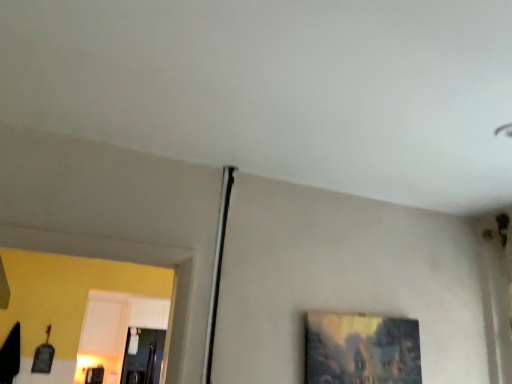
The image size is (512, 384). What do you see at coordinates (361, 349) in the screenshot?
I see `matte wooden picture frame at lower right` at bounding box center [361, 349].

Image resolution: width=512 pixels, height=384 pixels. I want to click on matte wooden picture frame at lower right, so click(361, 349).

The image size is (512, 384). What do you see at coordinates (143, 356) in the screenshot? I see `transparent glass door at lower left` at bounding box center [143, 356].

The image size is (512, 384). I want to click on transparent glass door at lower left, so click(143, 356).

This screenshot has width=512, height=384. What are the coordinates of `matte wooden picture frame at lower right` in the screenshot? It's located at (361, 349).

Considering the relative positions of transparent glass door at lower left and matte wooden picture frame at lower right in the image provided, is transparent glass door at lower left to the left or to the right of matte wooden picture frame at lower right?

transparent glass door at lower left is to the left of matte wooden picture frame at lower right.

Which object is further away from the camera taking this photo, transparent glass door at lower left or matte wooden picture frame at lower right?

transparent glass door at lower left is more distant.

Considering the positions of points (138, 350) and (333, 331), is point (138, 350) closer to camera compared to point (333, 331)?

No.

Based on the photo, from the image's perspective, which is below, transparent glass door at lower left or matte wooden picture frame at lower right?

transparent glass door at lower left is shown below in the image.

From a real-world perspective, is transparent glass door at lower left above or below matte wooden picture frame at lower right?

In terms of real-world spatial position, transparent glass door at lower left is below matte wooden picture frame at lower right.

Looking at their sizes, would you say transparent glass door at lower left is wider or thinner than matte wooden picture frame at lower right?

In the image, transparent glass door at lower left appears to be wider than matte wooden picture frame at lower right.

Which of these two, transparent glass door at lower left or matte wooden picture frame at lower right, stands shorter?

matte wooden picture frame at lower right is shorter.

Who is bigger, transparent glass door at lower left or matte wooden picture frame at lower right?

Bigger between the two is transparent glass door at lower left.

Is transparent glass door at lower left inside or outside of matte wooden picture frame at lower right?

transparent glass door at lower left is not inside matte wooden picture frame at lower right, it's outside.

Is transparent glass door at lower left touching matte wooden picture frame at lower right?

transparent glass door at lower left and matte wooden picture frame at lower right are clearly separated.

Is transparent glass door at lower left oriented towards matte wooden picture frame at lower right?

Yes, transparent glass door at lower left is aimed at matte wooden picture frame at lower right.

Image resolution: width=512 pixels, height=384 pixels. I want to click on picture frame in front of the transparent glass door at lower left, so coord(361,349).

In the scene shown: Considering the relative positions of matte wooden picture frame at lower right and transparent glass door at lower left in the image provided, is matte wooden picture frame at lower right to the left of transparent glass door at lower left from the viewer's perspective?

Incorrect, matte wooden picture frame at lower right is not on the left side of transparent glass door at lower left.

Which object is further away from the camera taking this photo, matte wooden picture frame at lower right or transparent glass door at lower left?

transparent glass door at lower left is behind.

Is point (326, 365) positioned in front of point (146, 376)?

Yes, it is.

From the image's perspective, which is below, matte wooden picture frame at lower right or transparent glass door at lower left?

transparent glass door at lower left appears lower in the image.

From a real-world perspective, is matte wooden picture frame at lower right positioned over transparent glass door at lower left based on gravity?

Correct, in the physical world, matte wooden picture frame at lower right is higher than transparent glass door at lower left.

Is matte wooden picture frame at lower right wider or thinner than transparent glass door at lower left?

Clearly, matte wooden picture frame at lower right has less width compared to transparent glass door at lower left.

Between matte wooden picture frame at lower right and transparent glass door at lower left, which one has more height?

transparent glass door at lower left is taller.

Who is bigger, matte wooden picture frame at lower right or transparent glass door at lower left?

transparent glass door at lower left.

Is transparent glass door at lower left completely or partially inside matte wooden picture frame at lower right?

No.

Is matte wooden picture frame at lower right far away from transparent glass door at lower left?

matte wooden picture frame at lower right is positioned a significant distance from transparent glass door at lower left.

Is transparent glass door at lower left at the back of matte wooden picture frame at lower right?

Yes.

Can you tell me how much matte wooden picture frame at lower right and transparent glass door at lower left differ in facing direction?

1.78 degrees.

Could you measure the distance between matte wooden picture frame at lower right and transparent glass door at lower left?

matte wooden picture frame at lower right is 3.50 meters away from transparent glass door at lower left.

Locate an element on the screen. Image resolution: width=512 pixels, height=384 pixels. picture frame above the transparent glass door at lower left (from the image's perspective) is located at coordinates (361, 349).

This screenshot has width=512, height=384. I want to click on glass door on the left of matte wooden picture frame at lower right, so click(143, 356).

Image resolution: width=512 pixels, height=384 pixels. Identify the location of picture frame above the transparent glass door at lower left (from the image's perspective). (361, 349).